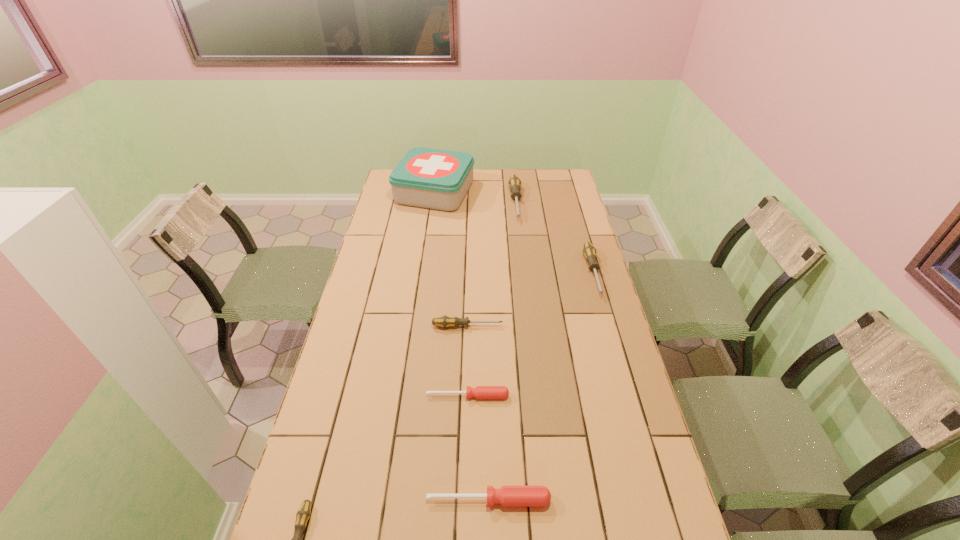
This screenshot has height=540, width=960. I want to click on object present at the right edge, so click(x=589, y=251).

Find the location of a particular element. object that is at the far left corner is located at coordinates (437, 179).

Where is `free space at the far edge`? free space at the far edge is located at coordinates (485, 178).

The image size is (960, 540). Identify the location of vacant space at the left edge of the desktop. (371, 277).

Where is `vacant point at the right edge`? vacant point at the right edge is located at coordinates (590, 280).

I want to click on free space between the rightmost object and the smaller red screwdriver, so click(531, 334).

At what (x,y) coordinates should I click in order to perform the action: click on empty space that is in between the second gray screwdriver from right to left and the farther red screwdriver. Please return your answer as a coordinate pair (x, y). The width and height of the screenshot is (960, 540). Looking at the image, I should click on (492, 299).

The height and width of the screenshot is (540, 960). I want to click on vacant area that lies between the farthest screwdriver and the bigger red screwdriver, so click(502, 351).

This screenshot has height=540, width=960. I want to click on vacant area that lies between the first-aid kit and the nearer red screwdriver, so click(462, 346).

Where is `vacant point located between the sixth shortest object and the farther red screwdriver`? vacant point located between the sixth shortest object and the farther red screwdriver is located at coordinates (492, 299).